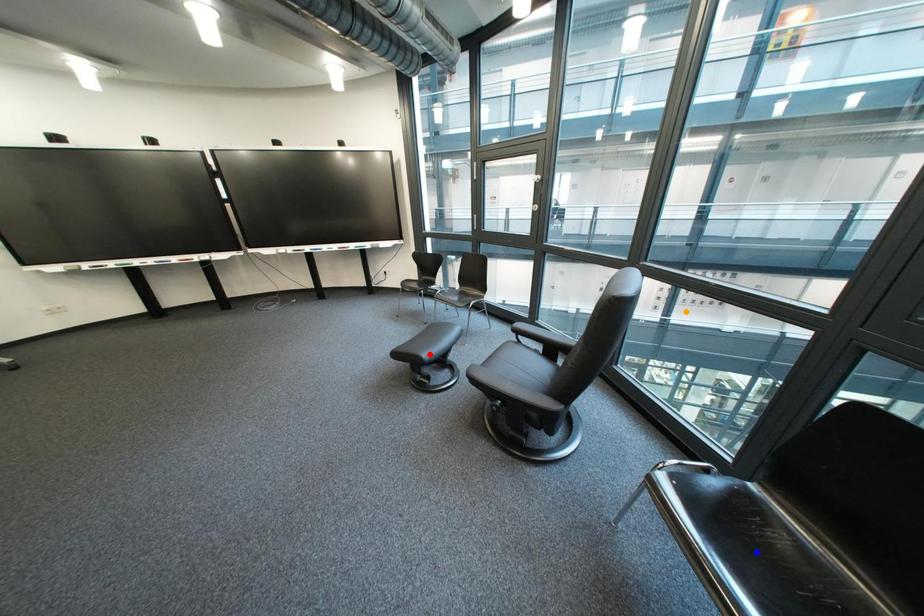
Order these from nearest to farthest:
red point | blue point | orange point

blue point, red point, orange point